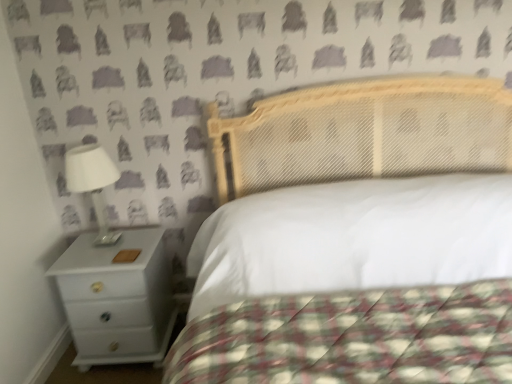
You are a GUI agent. You are given a task and a screenshot of the screen. Output one action in this format:
    pyautogui.click(x=<x>, y=<y>)
    Task: Click on the free space below white glossy lamp at left (from a real-world perspective)
    
    Given the screenshot: What is the action you would take?
    pyautogui.click(x=109, y=240)